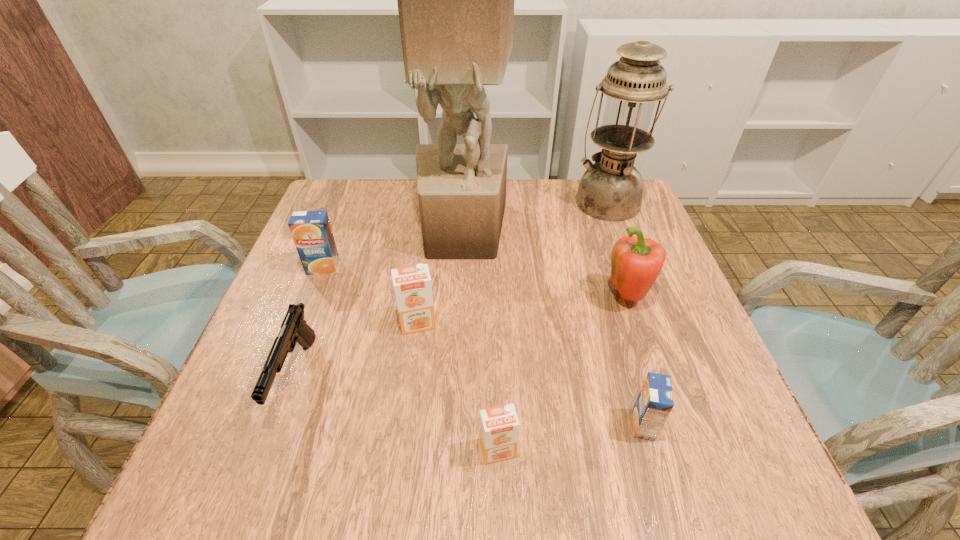
I want to click on the rightmost orange juice, so click(x=655, y=401).

Where is `the right blue orange_juice`? The height and width of the screenshot is (540, 960). the right blue orange_juice is located at coordinates (655, 401).

Locate an element on the screen. This screenshot has height=540, width=960. the nearer orange orange juice is located at coordinates (499, 426).

You are a GUI agent. You are given a task and a screenshot of the screen. Output one action in this format:
    pyautogui.click(x=<x>, y=<y>)
    Task: Click on the smaller orange orange juice
    This screenshot has height=540, width=960.
    Given the screenshot: What is the action you would take?
    [499, 426]

Find the location of a particular element. vacant space situated on the front-facing side of the tallest object is located at coordinates (455, 382).

At what (x,y) coordinates should I click in order to perform the action: click on vacant space positioned on the front of the oil lamp. Please return your answer as a coordinate pair (x, y). Image resolution: width=960 pixels, height=540 pixels. Looking at the image, I should click on (630, 262).

Where is `vacant space located 0.130m on the front of the orange pepper`? The image size is (960, 540). vacant space located 0.130m on the front of the orange pepper is located at coordinates (653, 369).

This screenshot has height=540, width=960. I want to click on free spot located on the right of the farthest orange juice, so click(413, 268).

At what (x,y) coordinates should I click in order to perform the action: click on free location located on the right of the third orange juice from right to left. Please return your answer as a coordinate pair (x, y). The height and width of the screenshot is (540, 960). Looking at the image, I should click on (505, 323).

Where is `free region located at the aiming end of the black gun`? The width and height of the screenshot is (960, 540). free region located at the aiming end of the black gun is located at coordinates tap(256, 487).